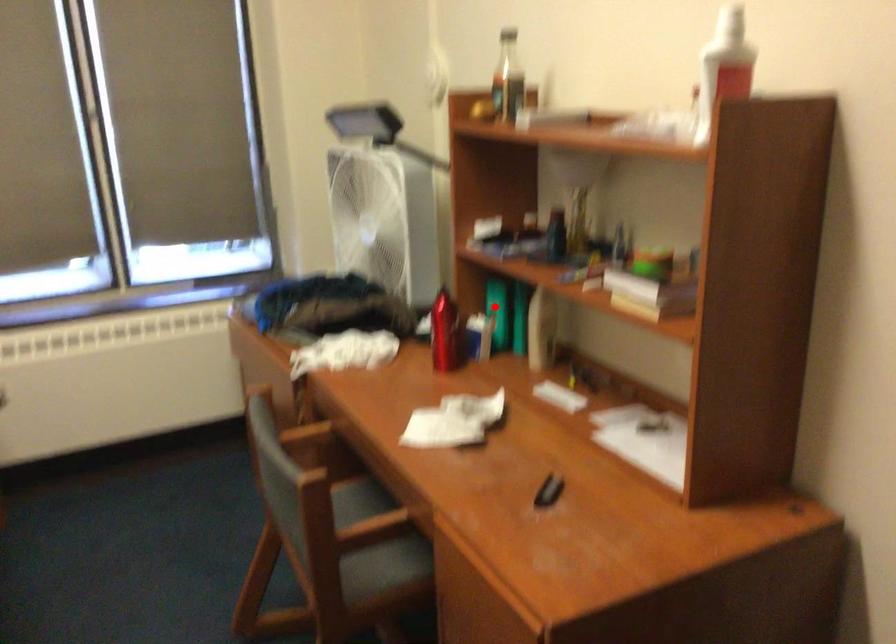
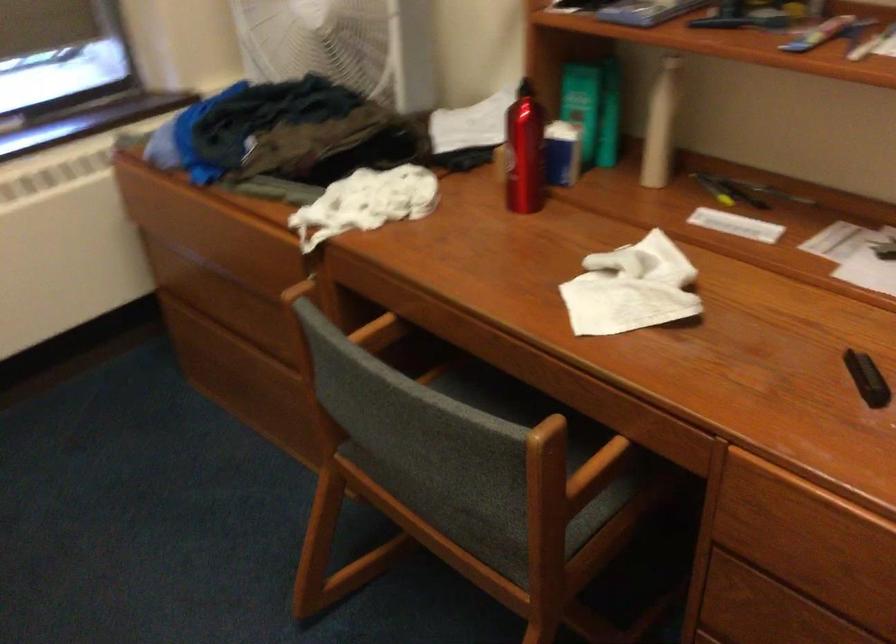
Question: I am providing you with two images of the same scene from different viewpoints. A red point is marked on the first image. Is the red point's position out of view in image 2?

Choices:
 (A) Yes
 (B) No

Answer: (B)